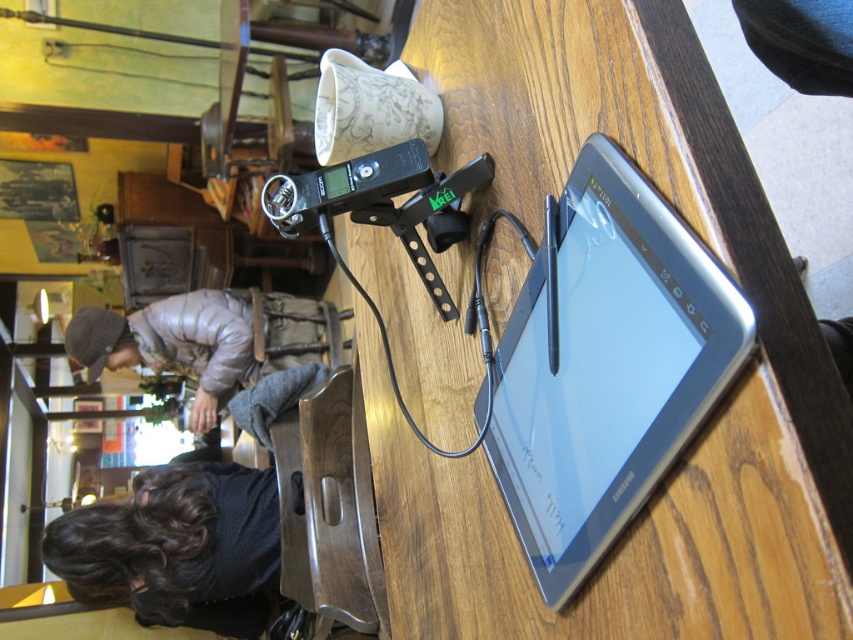
Question: Is silver metallic tablet at center above gray down jacket at lower left?

Choices:
 (A) no
 (B) yes

Answer: (B)

Question: Among these objects, which one is farthest from the camera?

Choices:
 (A) silver metallic tablet at center
 (B) dark curly hair at lower left
 (C) gray down jacket at lower left

Answer: (C)

Question: Can you confirm if silver metallic tablet at center is positioned below dark curly hair at lower left?

Choices:
 (A) no
 (B) yes

Answer: (A)

Question: Which of the following is the closest to the observer?

Choices:
 (A) (741, 374)
 (B) (248, 348)
 (C) (712, 321)
 (D) (57, 545)

Answer: (A)

Question: Can you confirm if silver metallic tablet at center is smaller than gray down jacket at lower left?

Choices:
 (A) yes
 (B) no

Answer: (A)

Question: Based on their relative distances, which object is farther from the dark curly hair at lower left?

Choices:
 (A) wooden table at center
 (B) silver metallic tablet at center

Answer: (B)